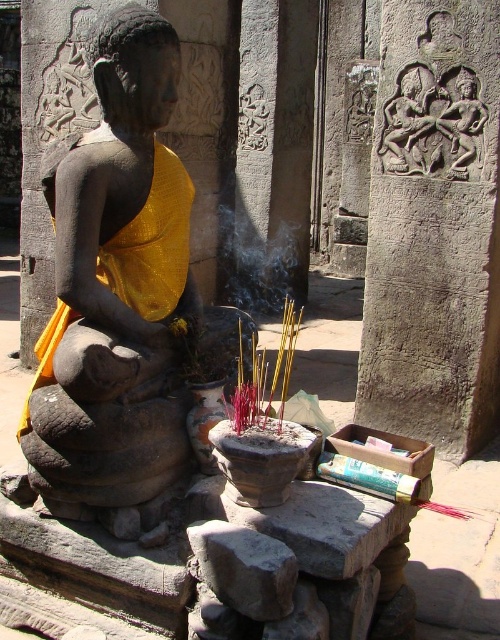
You are a visitor at the temple and want to take a photo of both the carved stone relief at upper right and the smoketransparent at center. Which object should you focus on first to ensure both are in the frame?

The carved stone relief at upper right is smaller than the smoketransparent at center, so you should focus on the smoketransparent at center first to ensure both fit in the frame.

You are a visitor standing in front of the seated Buddha statue. You notice the carved stone relief at upper right and the smoketransparent at center. Which object is closer to the ground?

The carved stone relief at upper right is closer to the ground because it is positioned below the smoketransparent at center.

You are a visitor standing at the entrance of the temple. You see the smoketransparent at center and the carved stone figure at upper right. Which object is closer to you?

The smoketransparent at center is closer to you because the carved stone figure at upper right is behind it.